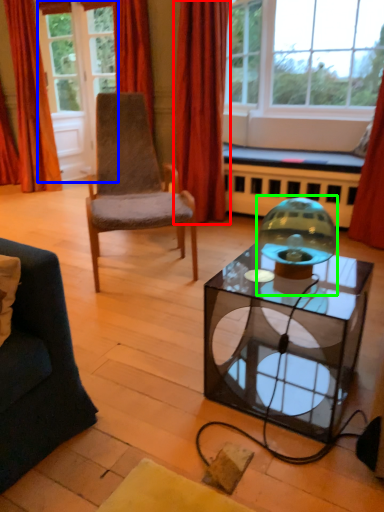
Question: Considering the real-world distances, which object is farthest from curtain (highlighted by a red box)? glass door (highlighted by a blue box) or candle holder (highlighted by a green box)?

Choices:
 (A) glass door
 (B) candle holder

Answer: (B)